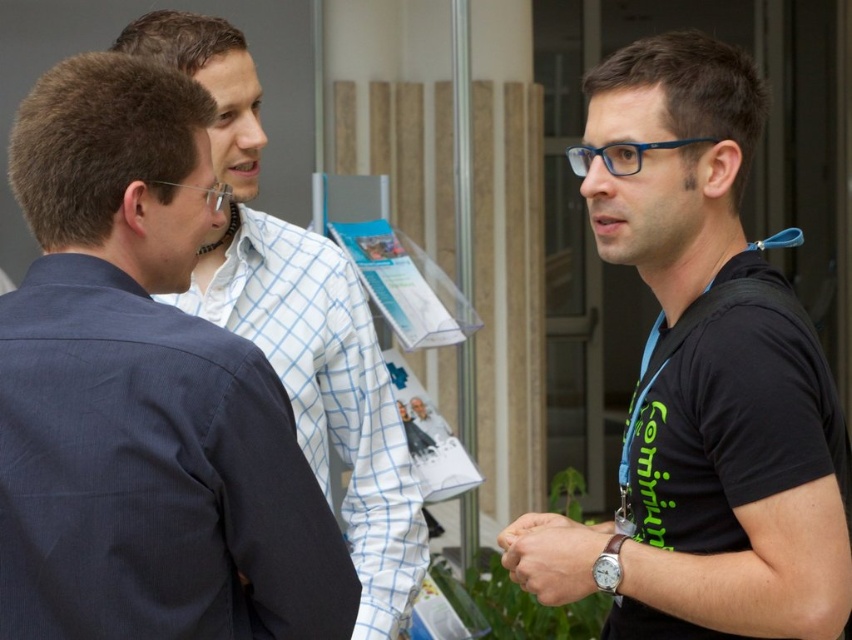
Between black matte t-shirt at center and blue fabric lanyard at right, which one appears on the right side from the viewer's perspective?

blue fabric lanyard at right is more to the right.

Based on the photo, does black matte t-shirt at center have a greater height compared to blue fabric lanyard at right?

Yes, black matte t-shirt at center is taller than blue fabric lanyard at right.

Which is behind, point (672, 77) or point (792, 237)?

The point (792, 237) is behind.

You are a GUI agent. You are given a task and a screenshot of the screen. Output one action in this format:
    pyautogui.click(x=<x>, y=<y>)
    Task: Click on the black matte t-shirt at center
    
    Given the screenshot: What is the action you would take?
    pyautogui.click(x=735, y=492)

Based on the photo, does blue checkered shirt at left have a smaller size compared to leather wristwatch at lower right?

No.

Between blue checkered shirt at left and leather wristwatch at lower right, which one appears on the left side from the viewer's perspective?

blue checkered shirt at left

Between point (118, 419) and point (551, 516), which one is positioned behind?

Positioned behind is point (551, 516).

Where is `blue checkered shirt at left`? Image resolution: width=852 pixels, height=640 pixels. blue checkered shirt at left is located at coordinates click(x=142, y=394).

In the scene shown: Between white checkered shirt at left and silver metallic watch at right, which one has less height?

Standing shorter between the two is silver metallic watch at right.

Looking at this image, can you confirm if white checkered shirt at left is taller than silver metallic watch at right?

Yes.

Is point (400, 449) behind point (603, 572)?

That is True.

You are a GUI agent. You are given a task and a screenshot of the screen. Output one action in this format:
    pyautogui.click(x=<x>, y=<y>)
    Task: Click on the white checkered shirt at left
    The width and height of the screenshot is (852, 640).
    Given the screenshot: What is the action you would take?
    pyautogui.click(x=327, y=394)